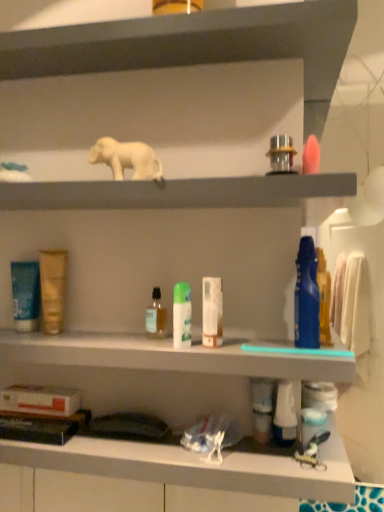
Question: Is metallic silver faucet at upper center, which is counted as the 3th toiletry, starting from the right, in contact with white matte tube at center, arranged as the 4th toiletry when viewed from the right?

Choices:
 (A) yes
 (B) no

Answer: (B)

Question: Is the position of metallic silver faucet at upper center, which is counted as the 3th toiletry, starting from the right, less distant than that of white matte tube at center, arranged as the 4th toiletry when viewed from the right?

Choices:
 (A) no
 (B) yes

Answer: (B)

Question: From the image's perspective, is metallic silver faucet at upper center, the fifth toiletry viewed from the left, on top of white matte tube at center, arranged as the 4th toiletry when viewed from the right?

Choices:
 (A) no
 (B) yes

Answer: (B)

Question: Is white matte tube at center, the fourth toiletry when ordered from left to right, completely or partially inside metallic silver faucet at upper center, the fifth toiletry viewed from the left?

Choices:
 (A) yes
 (B) no

Answer: (B)

Question: From a real-world perspective, is metallic silver faucet at upper center, the fifth toiletry viewed from the left, located beneath white matte tube at center, the fourth toiletry when ordered from left to right?

Choices:
 (A) yes
 (B) no

Answer: (B)

Question: Does point (329, 334) appear closer or farther from the camera than point (21, 308)?

Choices:
 (A) farther
 (B) closer

Answer: (A)

Question: Looking at the image, does blue glossy toothpaste at right, which ranks as the 1th toiletry in right-to-left order, seem bigger or smaller compared to blue matte tube at left, the first toiletry positioned from the left?

Choices:
 (A) big
 (B) small

Answer: (B)

Question: Looking at their shapes, would you say blue glossy toothpaste at right, which ranks as the 1th toiletry in right-to-left order, is wider or thinner than blue matte tube at left, arranged as the 7th toiletry when viewed from the right?

Choices:
 (A) wide
 (B) thin

Answer: (A)

Question: Is blue glossy toothpaste at right, which appears as the 7th toiletry when viewed from the left, inside the boundaries of blue matte tube at left, the first toiletry positioned from the left, or outside?

Choices:
 (A) inside
 (B) outside

Answer: (B)

Question: From a real-world perspective, relative to white matte tube at center, arranged as the 4th toiletry when viewed from the right, is white matte elephant at upper center vertically above or below?

Choices:
 (A) above
 (B) below

Answer: (A)

Question: Is white matte elephant at upper center taller or shorter than white matte tube at center, the fourth toiletry when ordered from left to right?

Choices:
 (A) tall
 (B) short

Answer: (B)

Question: Based on their positions, is white matte elephant at upper center located to the left or right of white matte tube at center, arranged as the 4th toiletry when viewed from the right?

Choices:
 (A) right
 (B) left

Answer: (B)

Question: Considering the positions of point (158, 166) and point (220, 325), is point (158, 166) closer or farther from the camera than point (220, 325)?

Choices:
 (A) closer
 (B) farther

Answer: (A)

Question: From the image's perspective, is matte gray shelf at upper center, the 2th shelf ordered from the bottom, located above or below white plastic bottles at center?

Choices:
 (A) below
 (B) above

Answer: (B)

Question: Is matte gray shelf at upper center, the 2th shelf ordered from the bottom, in front of or behind white plastic bottles at center in the image?

Choices:
 (A) behind
 (B) front

Answer: (A)